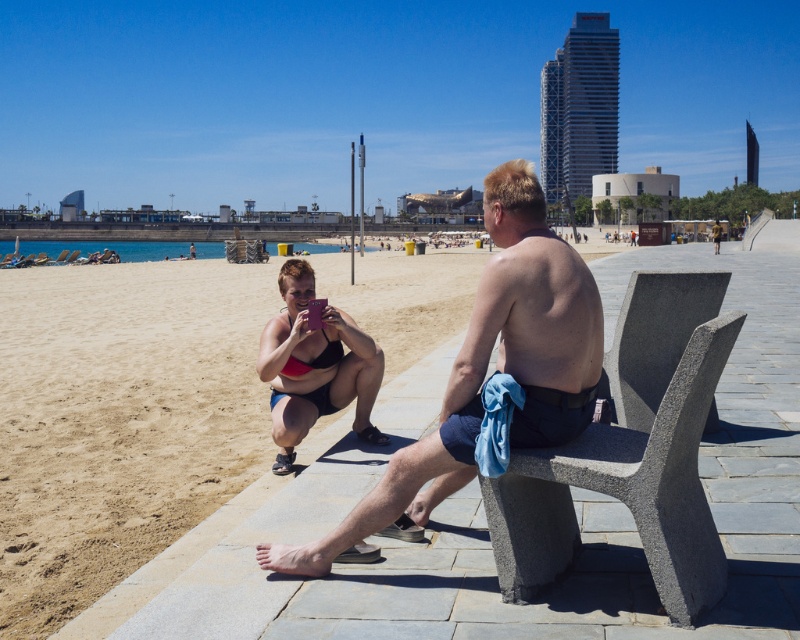
Does sandy beach at lower left have a larger size compared to gray concrete bench at right?

Yes, sandy beach at lower left is bigger than gray concrete bench at right.

Does sandy beach at lower left come in front of gray concrete bench at right?

No, sandy beach at lower left is behind gray concrete bench at right.

Is point (200, 356) less distant than point (709, 588)?

No, (200, 356) is further to viewer.

At what (x,y) coordinates should I click in order to perform the action: click on sandy beach at lower left. Please return your answer as a coordinate pair (x, y). Looking at the image, I should click on (480, 493).

Who is more forward, (566, 397) or (306, 296)?

Point (566, 397)

Measure the distance between smooth skin man at center and camera.

smooth skin man at center is 3.24 meters away from camera.

Where is `smooth skin man at center`? smooth skin man at center is located at coordinates (486, 371).

Does gray concrete bench at right come in front of matte pink bikini at center?

Yes, gray concrete bench at right is in front of matte pink bikini at center.

Measure the distance between gray concrete bench at right and camera.

A distance of 10.16 feet exists between gray concrete bench at right and camera.

Is point (512, 499) farther from camera compared to point (304, 356)?

No, (512, 499) is in front of (304, 356).

Find the location of a particular element. The height and width of the screenshot is (640, 800). gray concrete bench at right is located at coordinates (632, 451).